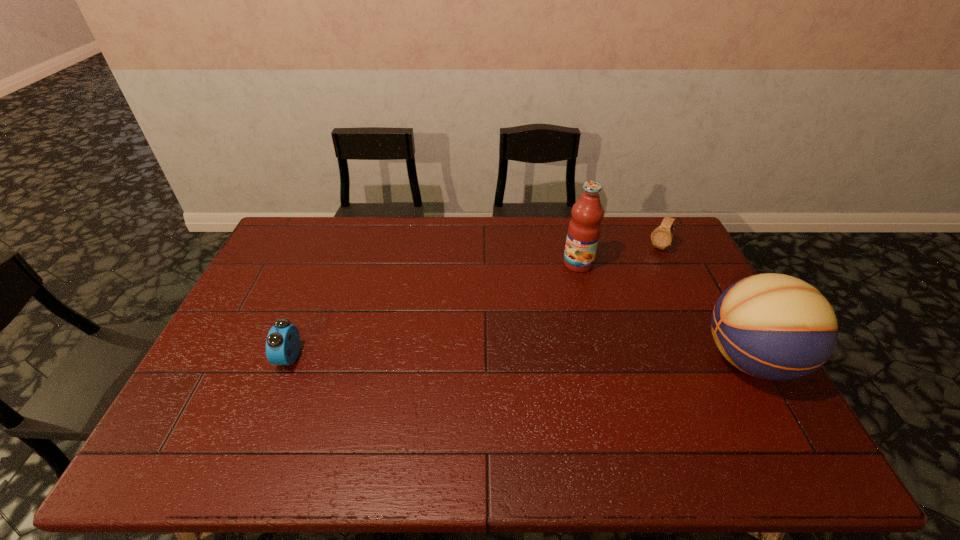
You are a GUI agent. You are given a task and a screenshot of the screen. Output one action in this format:
    pyautogui.click(x=<x>, y=<y>)
    Task: Click on the leftmost object
    This screenshot has height=540, width=960.
    Given the screenshot: What is the action you would take?
    pyautogui.click(x=283, y=341)

Identify the location of basketball. The image size is (960, 540). (772, 326).

At what (x,y) coordinates should I click in order to perform the action: click on fruit juice. Please return your answer as a coordinate pair (x, y). Image resolution: width=960 pixels, height=540 pixels. Looking at the image, I should click on (584, 229).

Find the location of a particular element. Image resolution: width=960 pixels, height=540 pixels. watch is located at coordinates (661, 237).

At what (x,y) coordinates should I click in order to perform the action: click on vacant region located on the face of the alarm clock. Please return your answer as a coordinate pair (x, y). Looking at the image, I should click on (259, 357).

Where is `free space located on the face of the alarm clock`? This screenshot has width=960, height=540. free space located on the face of the alarm clock is located at coordinates (244, 357).

You are a GUI agent. You are given a task and a screenshot of the screen. Output one action in this format:
    pyautogui.click(x=<x>, y=<y>)
    Task: Click on the vacant space situated on the face of the alarm clock
    The width and height of the screenshot is (960, 540).
    Given the screenshot: What is the action you would take?
    pyautogui.click(x=241, y=357)

Locate an element on the screen. The width and height of the screenshot is (960, 540). vacant space located on the patterned surface of the basketball is located at coordinates (657, 359).

The image size is (960, 540). Identify the location of vacant area situated on the patterned surface of the basketball. (675, 359).

Where is `blank space located 0.160m on the patterned surface of the basketball`? The width and height of the screenshot is (960, 540). blank space located 0.160m on the patterned surface of the basketball is located at coordinates (642, 359).